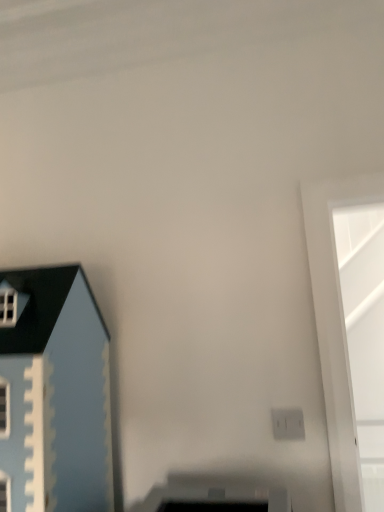
This screenshot has width=384, height=512. I want to click on matte blue castle at left, so click(54, 393).

This screenshot has width=384, height=512. What do you see at coordinates (54, 393) in the screenshot?
I see `matte blue castle at left` at bounding box center [54, 393].

The height and width of the screenshot is (512, 384). What are the coordinates of `matte blue castle at left` in the screenshot? It's located at (54, 393).